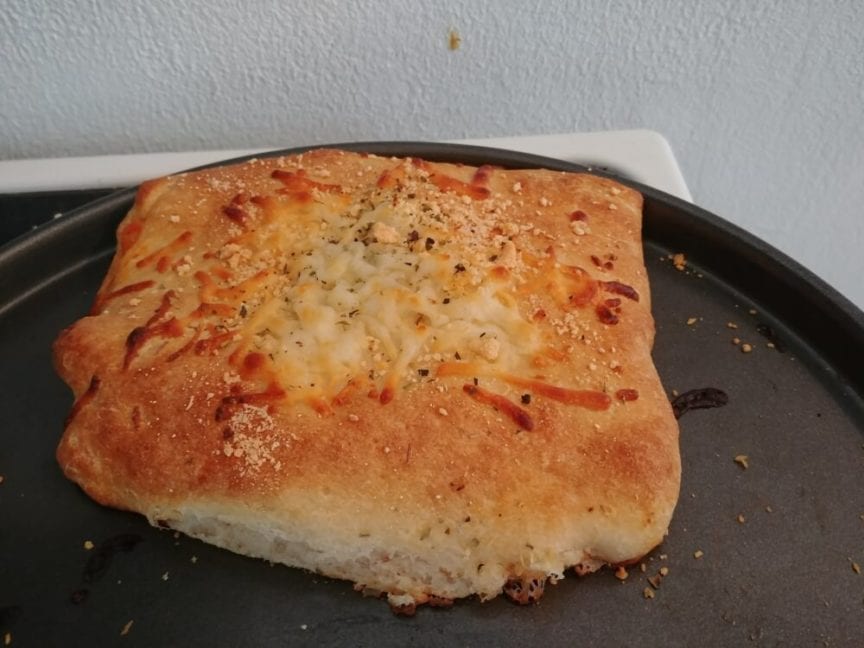
Identify the location of black pan. (804, 417).